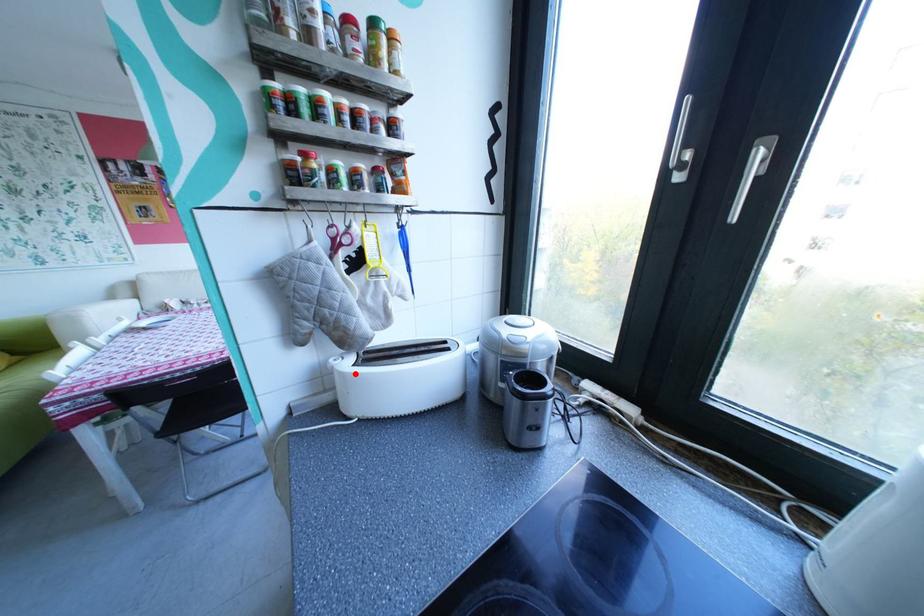
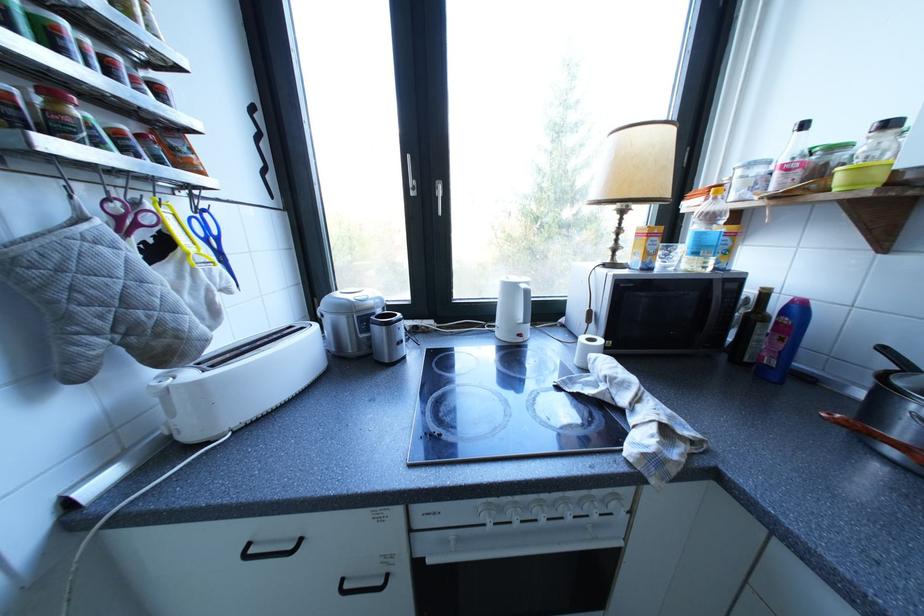
Locate, in the second image, the point that corresponds to the highlighted location in the first image.

(210, 384)